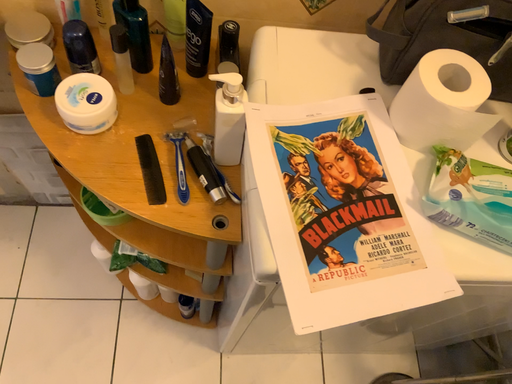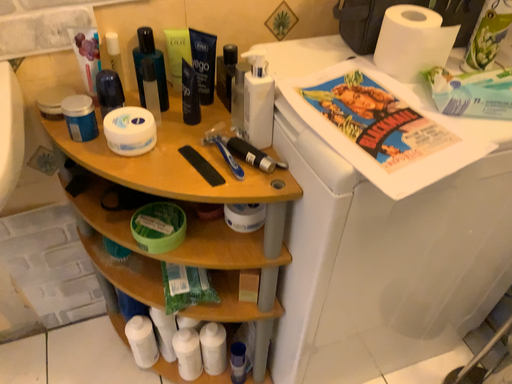
Question: Which way did the camera rotate in the video?

Choices:
 (A) rotated upward
 (B) rotated downward

Answer: (A)